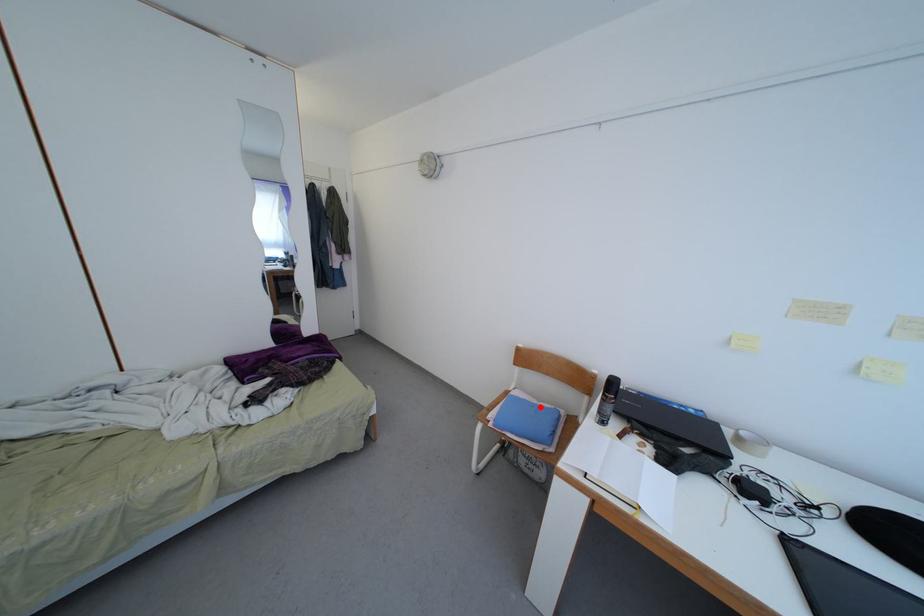
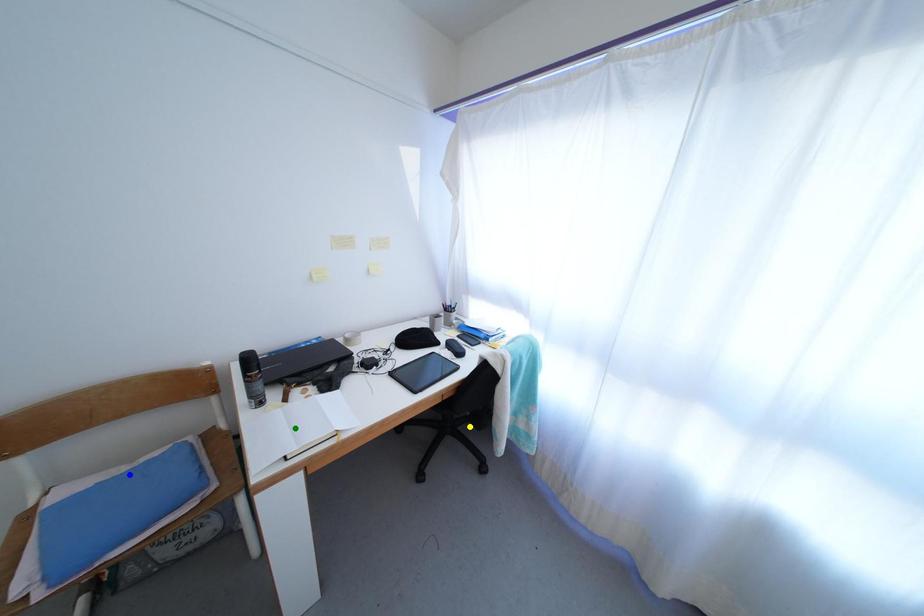
Question: I am providing you with two images of the same scene from different viewpoints. A red point is marked on the first image. You are given multiple points on the second image. Which mark in image 2 goes with the point in image 1?

Choices:
 (A) yellow point
 (B) blue point
 (C) green point

Answer: (B)